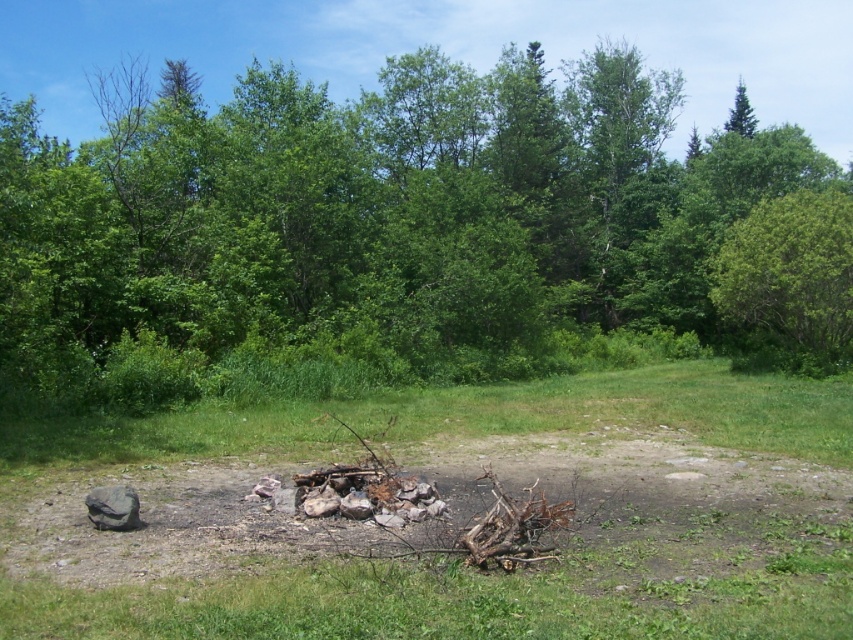
You are planning to set up a tent in the forest scene. You need to choose between the area near the green leafy tree at center or the green leafy tree at upper right. Which tree area would provide more shade due to its size?

The green leafy tree at center is larger in size than the green leafy tree at upper right, so the area near the green leafy tree at center would provide more shade.

You are standing at the edge of the forest clearing. You want to walk to the green leafy tree at center. What are the coordinates of the tree to guide your path?

The green leafy tree at center is located at coordinates point (374, 220).